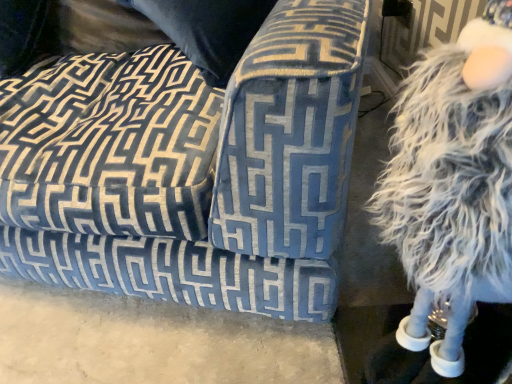
Question: Is white fluffy figurine at right positioned behind velvet blue couch at center?

Choices:
 (A) yes
 (B) no

Answer: (B)

Question: Considering the relative sizes of white fluffy figurine at right and velvet blue couch at center in the image provided, is white fluffy figurine at right shorter than velvet blue couch at center?

Choices:
 (A) no
 (B) yes

Answer: (A)

Question: Considering the relative positions of white fluffy figurine at right and velvet blue couch at center in the image provided, is white fluffy figurine at right to the left of velvet blue couch at center from the viewer's perspective?

Choices:
 (A) yes
 (B) no

Answer: (B)

Question: Are white fluffy figurine at right and velvet blue couch at center located far from each other?

Choices:
 (A) yes
 (B) no

Answer: (B)

Question: From a real-world perspective, is white fluffy figurine at right on velvet blue couch at center?

Choices:
 (A) no
 (B) yes

Answer: (B)

Question: From a real-world perspective, is white fluffy figurine at right located beneath velvet blue couch at center?

Choices:
 (A) yes
 (B) no

Answer: (B)

Question: Does velvet blue couch at center contain white fluffy figurine at right?

Choices:
 (A) yes
 (B) no

Answer: (B)

Question: Can you confirm if velvet blue couch at center is wider than white fluffy figurine at right?

Choices:
 (A) no
 (B) yes

Answer: (B)

Question: Can you confirm if velvet blue couch at center is bigger than white fluffy figurine at right?

Choices:
 (A) no
 (B) yes

Answer: (B)

Question: Is velvet blue couch at center facing towards white fluffy figurine at right?

Choices:
 (A) yes
 (B) no

Answer: (B)

Question: Is velvet blue couch at center not within white fluffy figurine at right?

Choices:
 (A) no
 (B) yes

Answer: (B)

Question: From a real-world perspective, is velvet blue couch at center positioned under white fluffy figurine at right based on gravity?

Choices:
 (A) no
 (B) yes

Answer: (B)

Question: Is white fluffy figurine at right to the left or to the right of velvet blue couch at center in the image?

Choices:
 (A) left
 (B) right

Answer: (B)